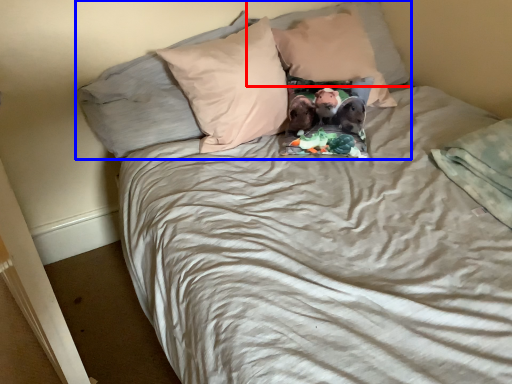
Question: Which point is closer to the camera, pillow (highlighted by a red box) or pillow (highlighted by a blue box)?

Choices:
 (A) pillow
 (B) pillow

Answer: (B)